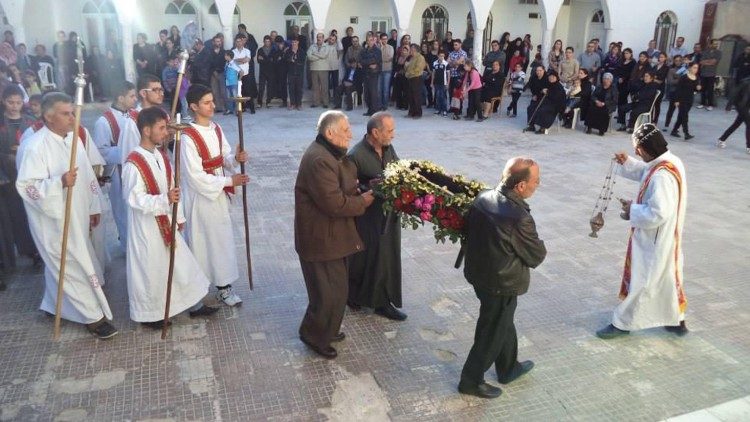
This screenshot has width=750, height=422. I want to click on wires, so click(606, 192).